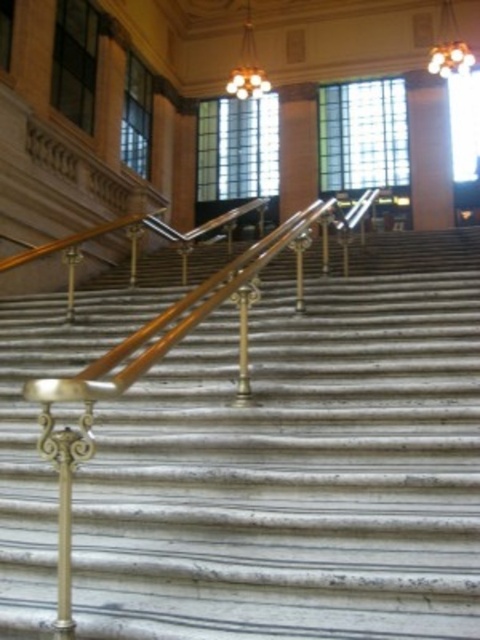
Question: Can you confirm if white marble pillar at upper center is positioned to the left of golden glass chandelier at upper center?

Choices:
 (A) no
 (B) yes

Answer: (B)

Question: Which object is positioned closest to the golden glass chandelier at upper center?

Choices:
 (A) gold textured chandelier at upper center
 (B) white marble pillar at upper center

Answer: (B)

Question: Which of the following is the closest to the observer?

Choices:
 (A) gold textured chandelier at upper center
 (B) white marble pillar at upper center
 (C) golden glass chandelier at upper center

Answer: (C)

Question: Among these points, which one is farthest from the camera?

Choices:
 (A) (235, 80)
 (B) (444, 22)
 (C) (450, 221)

Answer: (B)

Question: Does golden glass chandelier at upper center appear on the right side of gold textured chandelier at upper center?

Choices:
 (A) yes
 (B) no

Answer: (A)

Question: Does white marble pillar at upper center appear on the left side of gold textured chandelier at upper center?

Choices:
 (A) no
 (B) yes

Answer: (A)